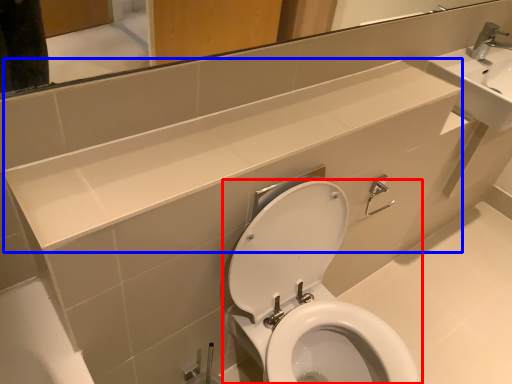
Question: Among these objects, which one is nearest to the camera, toilet (highlighted by a red box) or counter top (highlighted by a blue box)?

Choices:
 (A) toilet
 (B) counter top

Answer: (B)